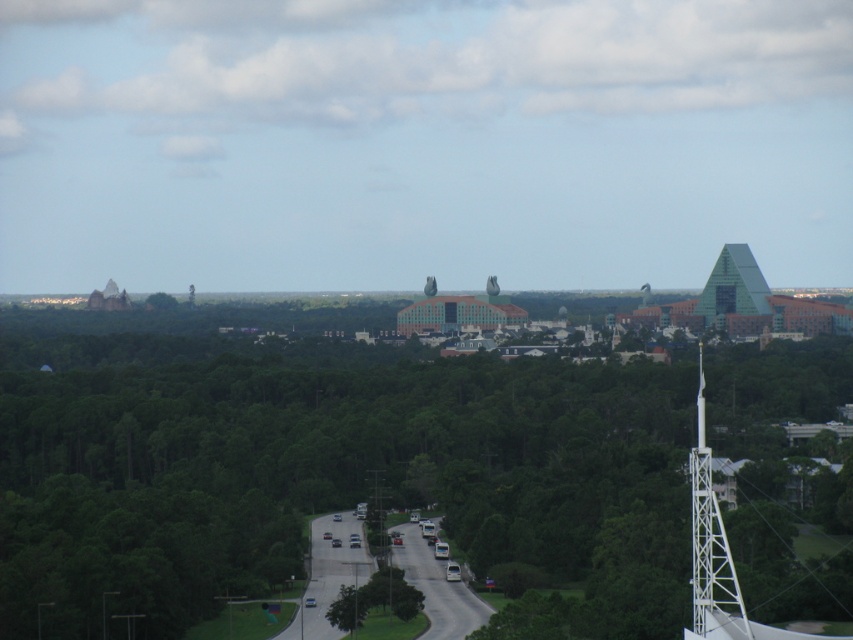
You are a drone operator planning to fly a drone from the green leafy tree at center to the green glass pyramid at upper right. According to the scene, which direction should you fly the drone to reach the pyramid?

The green leafy tree at center is to the left of the green glass pyramid at upper right, so you should fly the drone to the right to reach the pyramid.

You are a drone operator trying to navigate between two points in the landscape. You see a point at coordinates point (590, 493) and another at point (753, 282). Which point is closer to your current position if you are positioned at the starting point of the road?

Point (590, 493) is in front of point (753, 282), so it is closer to your current position at the starting point of the road.

Looking at this image, you are a drone operator trying to capture a photo of the green leafy tree at center. According to the coordinates provided, where exactly should the drone focus its camera to ensure the tree is centered in the frame?

The green leafy tree at center is located at coordinates point [328,472], so the drone should focus its camera at that exact point to center the tree in the frame.